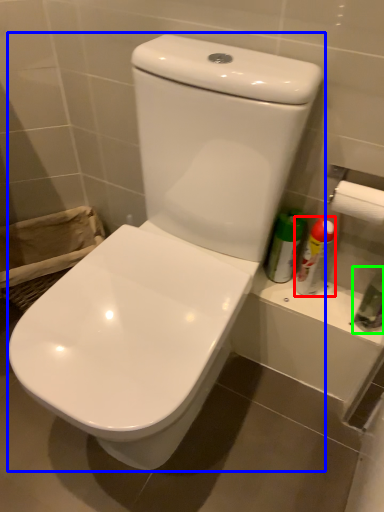
Question: Estimate the real-world distances between objects in this image. Which object is farther from cleaning product (highlighted by a red box), toilet (highlighted by a blue box) or toiletry (highlighted by a green box)?

Choices:
 (A) toilet
 (B) toiletry

Answer: (A)